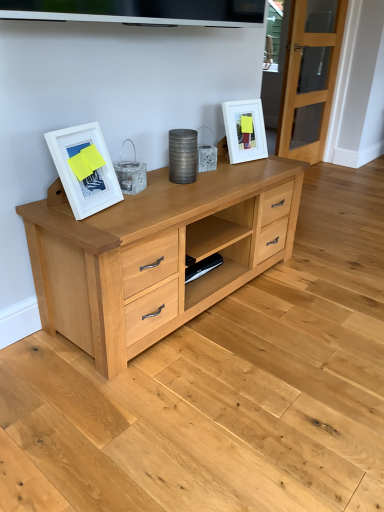
Question: Considering the relative sizes of white matte picture frame at left, arranged as the 2th picture frame when viewed from the back, and clear glass door at right in the image provided, is white matte picture frame at left, arranged as the 2th picture frame when viewed from the back, shorter than clear glass door at right?

Choices:
 (A) no
 (B) yes

Answer: (B)

Question: Does white matte picture frame at left, placed as the 1th picture frame when sorted from front to back, have a larger size compared to clear glass door at right?

Choices:
 (A) yes
 (B) no

Answer: (B)

Question: Can you confirm if white matte picture frame at left, arranged as the 2th picture frame when viewed from the back, is thinner than clear glass door at right?

Choices:
 (A) no
 (B) yes

Answer: (B)

Question: Would you consider white matte picture frame at left, arranged as the 2th picture frame when viewed from the back, to be distant from clear glass door at right?

Choices:
 (A) no
 (B) yes

Answer: (B)

Question: From the image's perspective, is white matte picture frame at left, placed as the 1th picture frame when sorted from front to back, located above clear glass door at right?

Choices:
 (A) yes
 (B) no

Answer: (B)

Question: Is white matte picture frame at left, the 1th picture frame positioned from the bottom, wider than clear glass door at right?

Choices:
 (A) yes
 (B) no

Answer: (B)

Question: Does white matte picture frame at left, placed as the 1th picture frame when sorted from front to back, appear on the right side of white matte picture frame at upper right, which appears as the first picture frame when viewed from the right?

Choices:
 (A) yes
 (B) no

Answer: (B)

Question: Is the position of white matte picture frame at left, which appears as the 2th picture frame when viewed from the top, less distant than that of white matte picture frame at upper right, which is the 2th picture frame in bottom-to-top order?

Choices:
 (A) yes
 (B) no

Answer: (A)

Question: Is the surface of white matte picture frame at left, which is counted as the second picture frame, starting from the right, in direct contact with white matte picture frame at upper right, which is the 2th picture frame in bottom-to-top order?

Choices:
 (A) no
 (B) yes

Answer: (A)

Question: From a real-world perspective, is white matte picture frame at left, the 1th picture frame positioned from the bottom, physically below white matte picture frame at upper right, which appears as the first picture frame when viewed from the right?

Choices:
 (A) yes
 (B) no

Answer: (B)

Question: Can we say white matte picture frame at left, arranged as the 2th picture frame when viewed from the back, lies outside white matte picture frame at upper right, which is the 2th picture frame in bottom-to-top order?

Choices:
 (A) yes
 (B) no

Answer: (A)

Question: Considering the relative sizes of white matte picture frame at left, which is counted as the second picture frame, starting from the right, and white matte picture frame at upper right, which is the 2th picture frame in bottom-to-top order, in the image provided, is white matte picture frame at left, which is counted as the second picture frame, starting from the right, smaller than white matte picture frame at upper right, which is the 2th picture frame in bottom-to-top order,?

Choices:
 (A) no
 (B) yes

Answer: (B)

Question: Is clear glass door at right oriented towards white matte picture frame at upper right, the 2th picture frame when ordered from front to back?

Choices:
 (A) no
 (B) yes

Answer: (A)